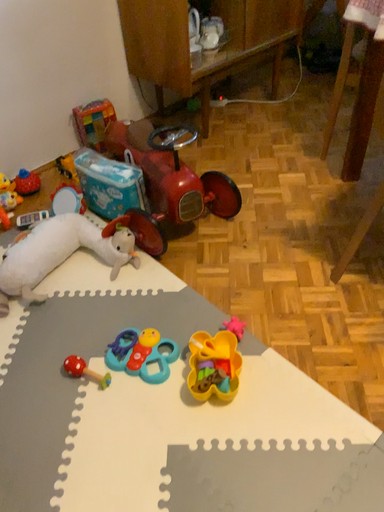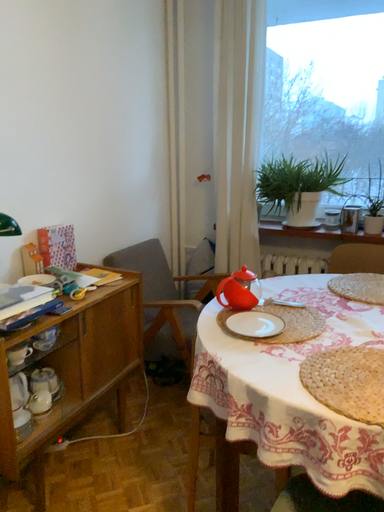
Question: How did the camera likely rotate when shooting the video?

Choices:
 (A) rotated downward
 (B) rotated upward

Answer: (B)